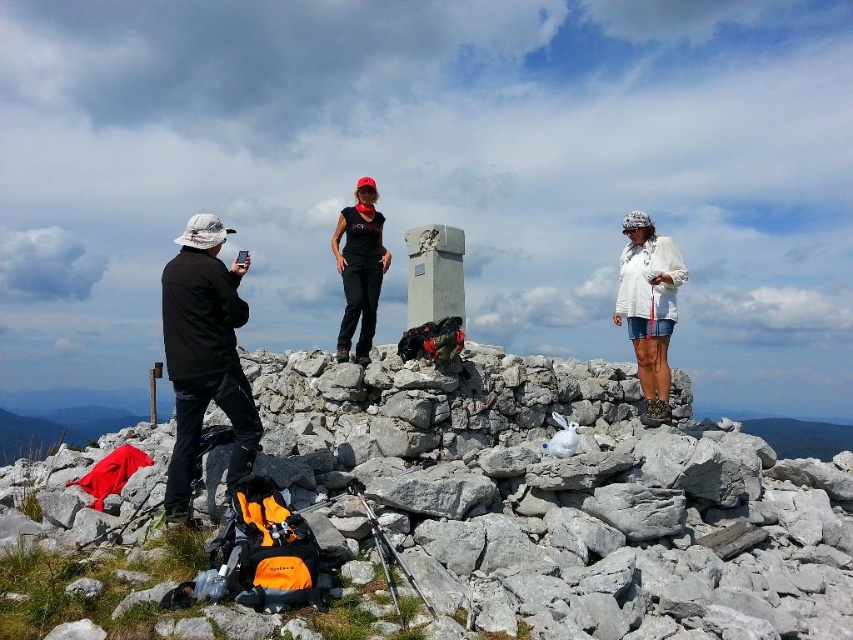
Is gray stone mountain at center above black matte shirt at center?

Incorrect, gray stone mountain at center is not positioned above black matte shirt at center.

Is gray stone mountain at center smaller than black matte shirt at center?

No.

The image size is (853, 640). In order to click on gray stone mountain at center in this screenshot , I will do `click(456, 515)`.

Where is `gray stone mountain at center`? This screenshot has width=853, height=640. gray stone mountain at center is located at coordinates (456, 515).

Measure the distance between gray stone mountain at center and camera.

gray stone mountain at center and camera are 12.85 meters apart.

Does point (241, 621) come farther from viewer compared to point (647, 406)?

No, (241, 621) is in front of (647, 406).

Where is `gray stone mountain at center`? gray stone mountain at center is located at coordinates (456, 515).

Who is lower down, gray stone mountain at center or black matte jacket at left?

gray stone mountain at center is lower down.

Does gray stone mountain at center appear on the right side of black matte jacket at left?

Indeed, gray stone mountain at center is positioned on the right side of black matte jacket at left.

Is point (195, 481) in front of point (199, 241)?

That is True.

Identify the location of gray stone mountain at center. (456, 515).